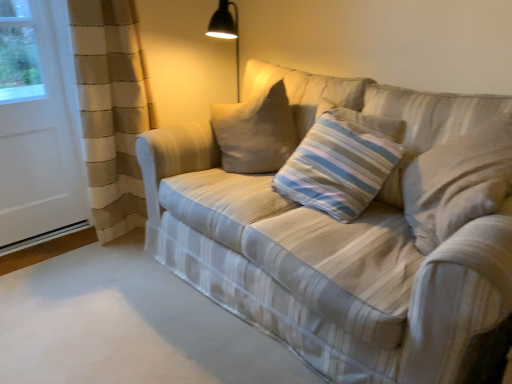
Question: Should I look upward or downward to see white matte screen door at left?

Choices:
 (A) down
 (B) up

Answer: (B)

Question: From a real-world perspective, is white matte screen door at left under plaid fabric couch at center?

Choices:
 (A) no
 (B) yes

Answer: (A)

Question: From the image's perspective, is white matte screen door at left located above plaid fabric couch at center?

Choices:
 (A) no
 (B) yes

Answer: (B)

Question: Are white matte screen door at left and plaid fabric couch at center located far from each other?

Choices:
 (A) no
 (B) yes

Answer: (B)

Question: Would you say white matte screen door at left is outside plaid fabric couch at center?

Choices:
 (A) yes
 (B) no

Answer: (A)

Question: Considering the relative positions of white matte screen door at left and plaid fabric couch at center in the image provided, is white matte screen door at left behind plaid fabric couch at center?

Choices:
 (A) no
 (B) yes

Answer: (B)

Question: Does white matte screen door at left have a greater height compared to plaid fabric couch at center?

Choices:
 (A) no
 (B) yes

Answer: (B)

Question: Is plaid fabric couch at center to the left of white matte screen door at left from the viewer's perspective?

Choices:
 (A) yes
 (B) no

Answer: (B)

Question: Does plaid fabric couch at center have a greater width compared to white matte screen door at left?

Choices:
 (A) yes
 (B) no

Answer: (A)

Question: Is plaid fabric couch at center smaller than white matte screen door at left?

Choices:
 (A) no
 (B) yes

Answer: (A)

Question: Is plaid fabric couch at center with white matte screen door at left?

Choices:
 (A) no
 (B) yes

Answer: (A)

Question: Considering the relative sizes of plaid fabric couch at center and white matte screen door at left in the image provided, is plaid fabric couch at center thinner than white matte screen door at left?

Choices:
 (A) yes
 (B) no

Answer: (B)

Question: From the image's perspective, is plaid fabric couch at center over white matte screen door at left?

Choices:
 (A) no
 (B) yes

Answer: (A)

Question: Can you confirm if plaid fabric couch at center is bigger than striped fabric pillow at center?

Choices:
 (A) no
 (B) yes

Answer: (B)